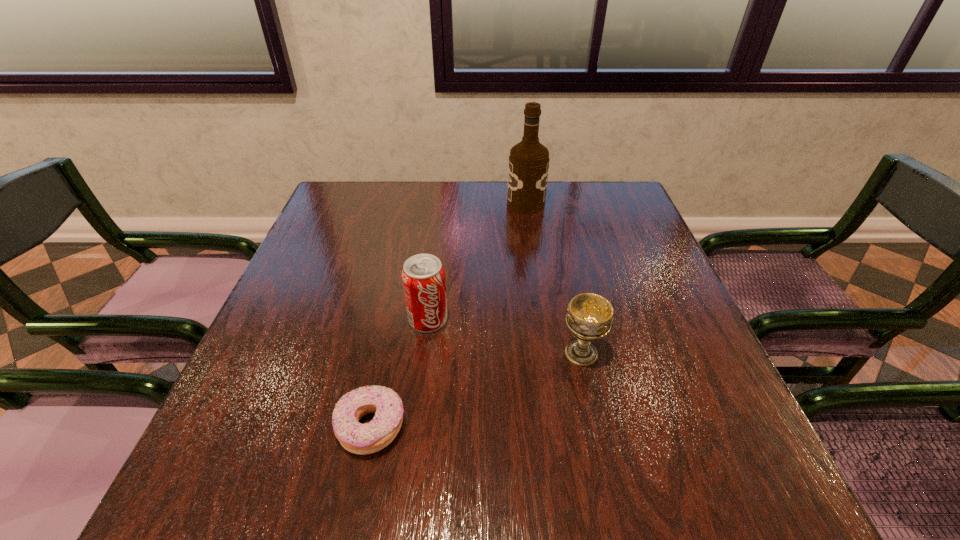
Where is `free space located 0.300m on the label of the farthest object`? This screenshot has height=540, width=960. free space located 0.300m on the label of the farthest object is located at coordinates (406, 204).

The width and height of the screenshot is (960, 540). Find the location of `vacant point located 0.270m on the right of the third shortest object`. vacant point located 0.270m on the right of the third shortest object is located at coordinates (573, 320).

The height and width of the screenshot is (540, 960). What are the coordinates of `vacant space situated on the back of the chalice` in the screenshot? It's located at (568, 295).

The height and width of the screenshot is (540, 960). I want to click on free space located on the right of the doughnut, so click(563, 427).

Locate an element on the screen. The height and width of the screenshot is (540, 960). object positioned at the far edge is located at coordinates (528, 168).

Where is `object that is at the near edge`? object that is at the near edge is located at coordinates click(362, 439).

In the image, there is a desktop. What are the coordinates of `vacant region at the far edge` in the screenshot? It's located at (407, 204).

Find the location of `vacant space at the near edge of the desktop`. vacant space at the near edge of the desktop is located at coordinates (542, 471).

This screenshot has width=960, height=540. In order to click on vacant space at the left edge of the desktop in this screenshot , I will do `click(334, 251)`.

This screenshot has width=960, height=540. What are the coordinates of `vacant space at the right edge` in the screenshot? It's located at (685, 417).